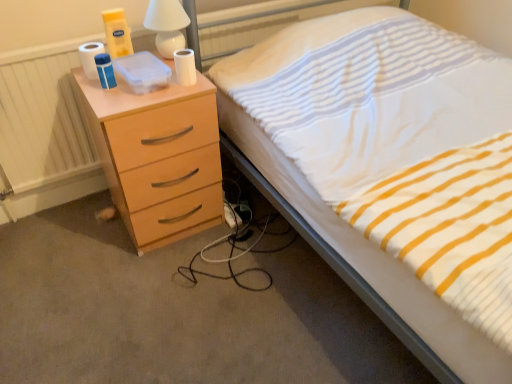
Question: Is point (232, 208) positioned closer to the camera than point (94, 77)?

Choices:
 (A) farther
 (B) closer

Answer: (A)

Question: From a real-world perspective, is white fabric extension cord at lower center above or below white matte toilet paper at upper left, acting as the 2th toilet paper starting from the right?

Choices:
 (A) above
 (B) below

Answer: (B)

Question: Estimate the real-world distances between objects in this image. Which object is farther from the white glossy lamp at upper center?

Choices:
 (A) white matte toilet paper at upper center, the 1th toilet paper viewed from the right
 (B) white striped fabric at upper right
 (C) white fabric extension cord at lower center
 (D) white matte toilet paper at upper left, marked as the 1th toilet paper in a left-to-right arrangement
 (E) matte wood chest of drawers at left

Answer: (C)

Question: Estimate the real-world distances between objects in this image. Which object is closer to the white striped fabric at upper right?

Choices:
 (A) matte wood chest of drawers at left
 (B) white matte toilet paper at upper left, marked as the 1th toilet paper in a left-to-right arrangement
 (C) white fabric extension cord at lower center
 (D) white matte toilet paper at upper center, positioned as the second toilet paper in left-to-right order
 (E) white glossy lamp at upper center

Answer: (A)